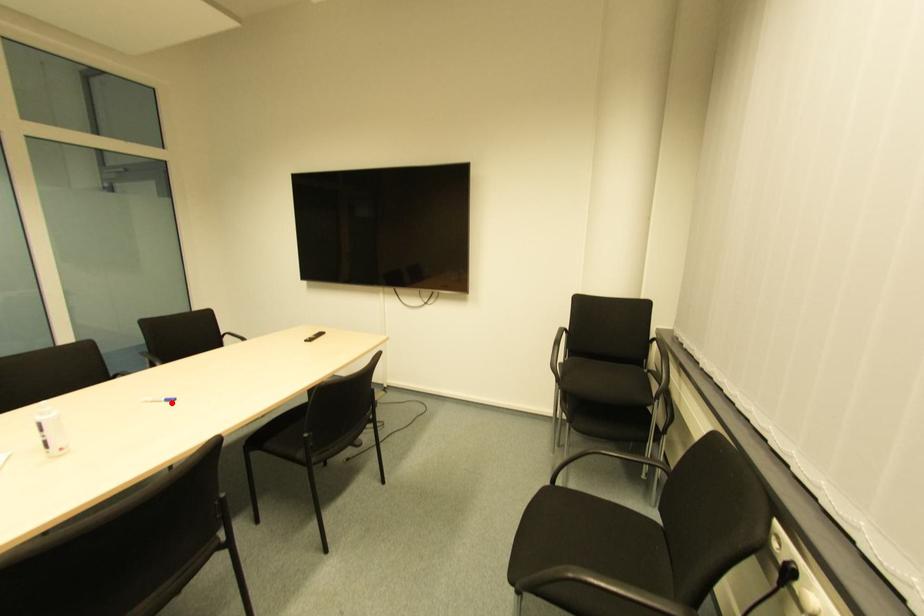
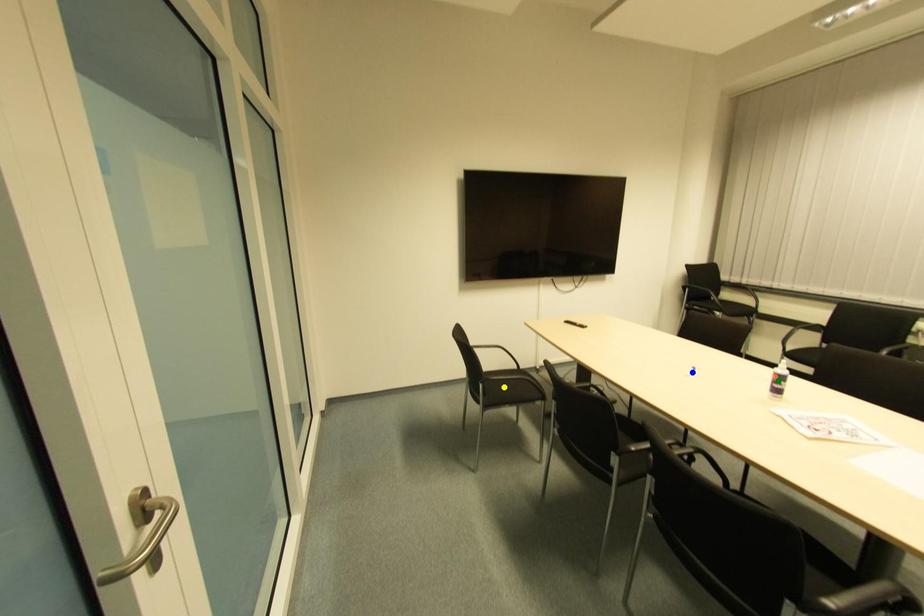
Question: I am providing you with two images of the same scene from different viewpoints. A red point is marked on the first image. You are given multiple points on the second image. In image 2, which mark is for the same physical point as the one in image 1?

Choices:
 (A) yellow point
 (B) blue point
 (C) green point

Answer: (B)